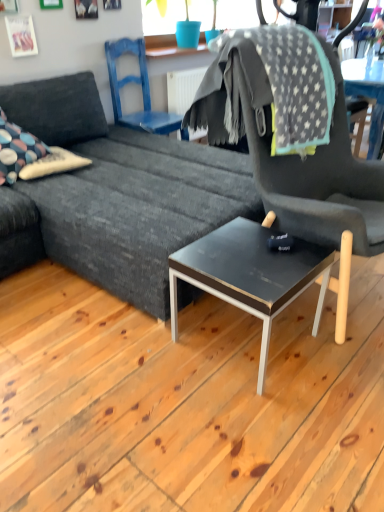
Image resolution: width=384 pixels, height=512 pixels. What do you see at coordinates (53, 164) in the screenshot?
I see `multicolored fabric pillow at left` at bounding box center [53, 164].

You are a GUI agent. You are given a task and a screenshot of the screen. Output one action in this format:
    pyautogui.click(x=<x>, y=<y>)
    Task: Click on the dark gray fabric chair at center, which ranks as the first chair in right-to-left order
    Image resolution: width=384 pixels, height=512 pixels.
    Given the screenshot: What is the action you would take?
    pyautogui.click(x=291, y=155)

What do you see at coordinates (268, 86) in the screenshot? The width and height of the screenshot is (384, 512). I see `gray star-patterned blanket at upper right` at bounding box center [268, 86].

This screenshot has width=384, height=512. Identify the location of blue painted wood chair at upper center, which ranks as the second chair in front-to-back order. (142, 91).

Locate an element on the screen. multicolored fabric pillow at left is located at coordinates (53, 164).

Which object is more forward, multicolored fabric pillow at left or black glossy coffee table at center?

Positioned in front is black glossy coffee table at center.

Between multicolored fabric pillow at left and black glossy coffee table at center, which one has less height?

multicolored fabric pillow at left is shorter.

Is multicolored fabric pillow at left with black glossy coffee table at center?

They are not placed beside each other.

From the image's perspective, would you say multicolored fabric pillow at left is positioned over black glossy coffee table at center?

Yes, from the image's perspective, multicolored fabric pillow at left is above black glossy coffee table at center.

Is gray star-patterned blanket at upper right to the left or to the right of dark gray fabric couch at center in the image?

In the image, gray star-patterned blanket at upper right appears on the right side of dark gray fabric couch at center.

From a real-world perspective, is gray star-patterned blanket at upper right physically below dark gray fabric couch at center?

No, from a real-world perspective, gray star-patterned blanket at upper right is not beneath dark gray fabric couch at center.

Does gray star-patterned blanket at upper right have a lesser width compared to dark gray fabric couch at center?

Correct, the width of gray star-patterned blanket at upper right is less than that of dark gray fabric couch at center.

Is point (332, 94) in front of point (84, 184)?

Yes, it is in front of point (84, 184).

From the image's perspective, is dark gray fabric couch at center above or below dark gray fabric chair at center, which ranks as the second chair in left-to-right order?

dark gray fabric couch at center is situated higher than dark gray fabric chair at center, which ranks as the second chair in left-to-right order, in the image.

Between point (68, 239) and point (361, 215), which one is positioned in front?

Point (361, 215)

Can you confirm if dark gray fabric couch at center is positioned to the right of dark gray fabric chair at center, which ranks as the first chair in right-to-left order?

No.

How far apart are dark gray fabric couch at center and dark gray fabric chair at center, which ranks as the first chair in right-to-left order?

18.24 inches.

Is dark gray fabric chair at center, which ranks as the second chair in left-to-right order, oriented away from black glossy coffee table at center?

No, dark gray fabric chair at center, which ranks as the second chair in left-to-right order, is not facing the opposite direction of black glossy coffee table at center.

Which of these two, dark gray fabric chair at center, which ranks as the first chair in right-to-left order, or black glossy coffee table at center, is thinner?

With smaller width is black glossy coffee table at center.

I want to click on coffee table behind the dark gray fabric chair at center, which ranks as the second chair in left-to-right order, so click(261, 276).

In terms of size, does dark gray fabric chair at center, which ranks as the second chair in left-to-right order, appear bigger or smaller than black glossy coffee table at center?

In the image, dark gray fabric chair at center, which ranks as the second chair in left-to-right order, appears to be larger than black glossy coffee table at center.

Which object is positioned more to the right, dark gray fabric chair at center, which ranks as the second chair in left-to-right order, or multicolored fabric pillow at left?

Positioned to the right is dark gray fabric chair at center, which ranks as the second chair in left-to-right order.

Is dark gray fabric chair at center, which appears as the 2th chair when viewed from the back, located outside multicolored fabric pillow at left?

Yes, dark gray fabric chair at center, which appears as the 2th chair when viewed from the back, is outside of multicolored fabric pillow at left.

Is dark gray fabric chair at center, the 1th chair positioned from the front, taller than multicolored fabric pillow at left?

Indeed, dark gray fabric chair at center, the 1th chair positioned from the front, has a greater height compared to multicolored fabric pillow at left.

Is dark gray fabric couch at center with black glossy coffee table at center?

No, dark gray fabric couch at center is not touching black glossy coffee table at center.

What's the angular difference between dark gray fabric couch at center and black glossy coffee table at center's facing directions?

The angle between the facing direction of dark gray fabric couch at center and the facing direction of black glossy coffee table at center is 90.3 degrees.

Between dark gray fabric couch at center and black glossy coffee table at center, which one has smaller width?

black glossy coffee table at center is thinner.

Is point (214, 172) farther from viewer compared to point (212, 269)?

That is True.

Is dark gray fabric chair at center, which ranks as the first chair in right-to-left order, not near gray star-patterned blanket at upper right?

dark gray fabric chair at center, which ranks as the first chair in right-to-left order, is near gray star-patterned blanket at upper right, not far away.

Would you say dark gray fabric chair at center, which ranks as the second chair in left-to-right order, contains gray star-patterned blanket at upper right?

That's correct, gray star-patterned blanket at upper right is inside dark gray fabric chair at center, which ranks as the second chair in left-to-right order.

Who is more distant, dark gray fabric chair at center, which ranks as the first chair in right-to-left order, or gray star-patterned blanket at upper right?

gray star-patterned blanket at upper right is more distant.

Is point (274, 30) farther from viewer compared to point (204, 122)?

No, (274, 30) is in front of (204, 122).

The width and height of the screenshot is (384, 512). In order to click on coffee table in front of the multicolored fabric pillow at left in this screenshot , I will do `click(261, 276)`.

Identify the location of blanket above the dark gray fabric couch at center (from a real-world perspective). (268, 86).

Based on their spatial positions, is gray star-patterned blanket at upper right or multicolored fabric pillow at left closer to blue painted wood chair at upper center, acting as the 1th chair starting from the left?

Based on the image, multicolored fabric pillow at left appears to be nearer to blue painted wood chair at upper center, acting as the 1th chair starting from the left.

Which object lies further to the anchor point multicolored fabric pillow at left, gray star-patterned blanket at upper right or black glossy coffee table at center?

Based on the image, black glossy coffee table at center appears to be further to multicolored fabric pillow at left.

Looking at the image, which one is located closer to gray star-patterned blanket at upper right, dark gray fabric chair at center, which ranks as the first chair in right-to-left order, or black glossy coffee table at center?

The object closer to gray star-patterned blanket at upper right is dark gray fabric chair at center, which ranks as the first chair in right-to-left order.

From the image, which object appears to be farther from blue painted wood chair at upper center, which is counted as the first chair, starting from the back, gray star-patterned blanket at upper right or dark gray fabric chair at center, which ranks as the second chair in left-to-right order?

dark gray fabric chair at center, which ranks as the second chair in left-to-right order.

Considering their positions, is dark gray fabric couch at center positioned further to black glossy coffee table at center than multicolored fabric pillow at left?

multicolored fabric pillow at left lies further to black glossy coffee table at center than the other object.

From the image, which object appears to be farther from dark gray fabric chair at center, which appears as the 2th chair when viewed from the back, gray star-patterned blanket at upper right or black glossy coffee table at center?

black glossy coffee table at center is further to dark gray fabric chair at center, which appears as the 2th chair when viewed from the back.

Estimate the real-world distances between objects in this image. Which object is further from dark gray fabric chair at center, the 1th chair positioned from the front, multicolored fabric pillow at left or blue painted wood chair at upper center, which ranks as the second chair in front-to-back order?

Among the two, blue painted wood chair at upper center, which ranks as the second chair in front-to-back order, is located further to dark gray fabric chair at center, the 1th chair positioned from the front.

Estimate the real-world distances between objects in this image. Which object is closer to dark gray fabric chair at center, the 1th chair positioned from the front, blue painted wood chair at upper center, the 2th chair viewed from the right, or black glossy coffee table at center?

black glossy coffee table at center is positioned closer to the anchor dark gray fabric chair at center, the 1th chair positioned from the front.

Locate an element on the screen. chair between gray star-patterned blanket at upper right and black glossy coffee table at center from top to bottom is located at coordinates (291, 155).

Locate an element on the screen. This screenshot has width=384, height=512. pillow between dark gray fabric couch at center and blue painted wood chair at upper center, the 2th chair viewed from the right, along the z-axis is located at coordinates (53, 164).

This screenshot has height=512, width=384. I want to click on coffee table positioned between dark gray fabric chair at center, which ranks as the first chair in right-to-left order, and blue painted wood chair at upper center, which ranks as the second chair in front-to-back order, from near to far, so click(261, 276).

At what (x,y) coordinates should I click in order to perform the action: click on studio couch situated between multicolored fabric pillow at left and dark gray fabric chair at center, which appears as the 2th chair when viewed from the back, from left to right. Please return your answer as a coordinate pair (x, y). Image resolution: width=384 pixels, height=512 pixels. Looking at the image, I should click on (124, 191).